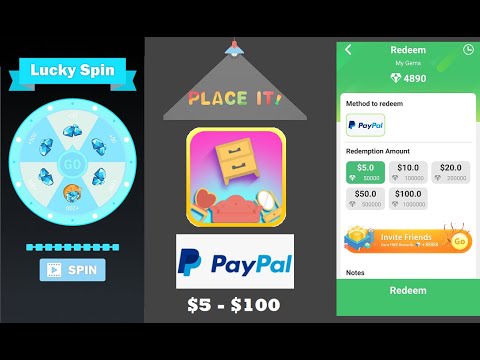
Find the location of a particular element. right front leg is located at coordinates (227, 182).